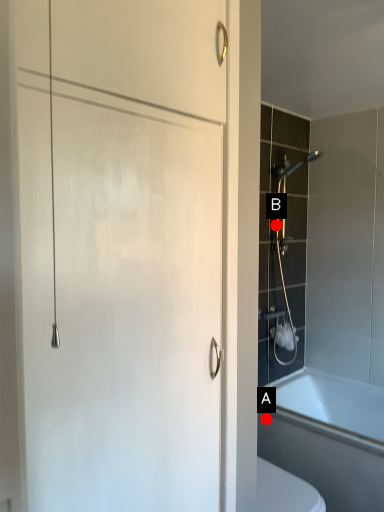
Question: Two points are circled on the image, labeled by A and B beside each circle. Which of the following is the closest to the observer?

Choices:
 (A) A is closer
 (B) B is closer

Answer: (A)